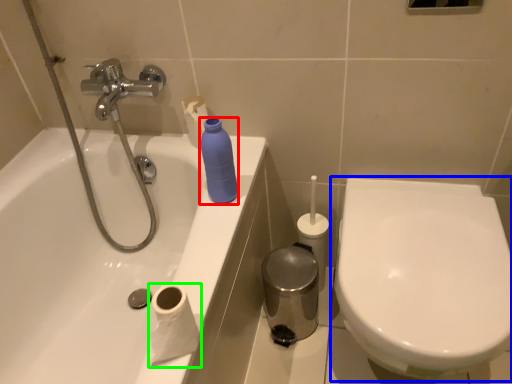
Question: Based on their relative distances, which object is farther from cleaning product (highlighted by a red box)? Choose from toilet (highlighted by a blue box) and toilet paper (highlighted by a green box).

Choices:
 (A) toilet
 (B) toilet paper

Answer: (A)